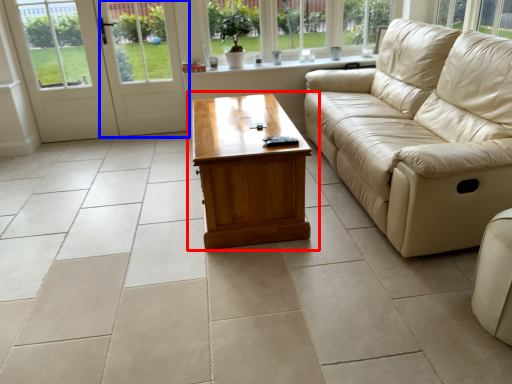
Question: Among these objects, which one is nearest to the camera, coffee table (highlighted by a red box) or screen door (highlighted by a blue box)?

Choices:
 (A) coffee table
 (B) screen door

Answer: (A)